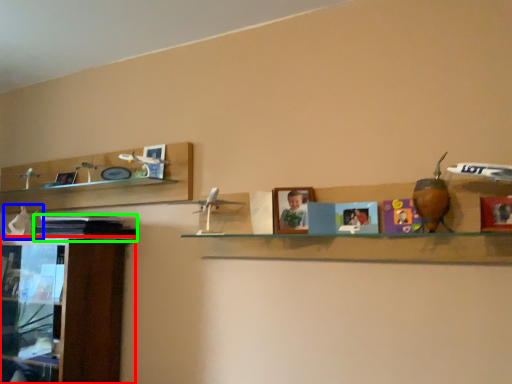
Question: Which object is positioned closest to cabinetry (highlighted by a red box)? Select from toy (highlighted by a blue box) and book (highlighted by a green box).

Choices:
 (A) toy
 (B) book

Answer: (B)